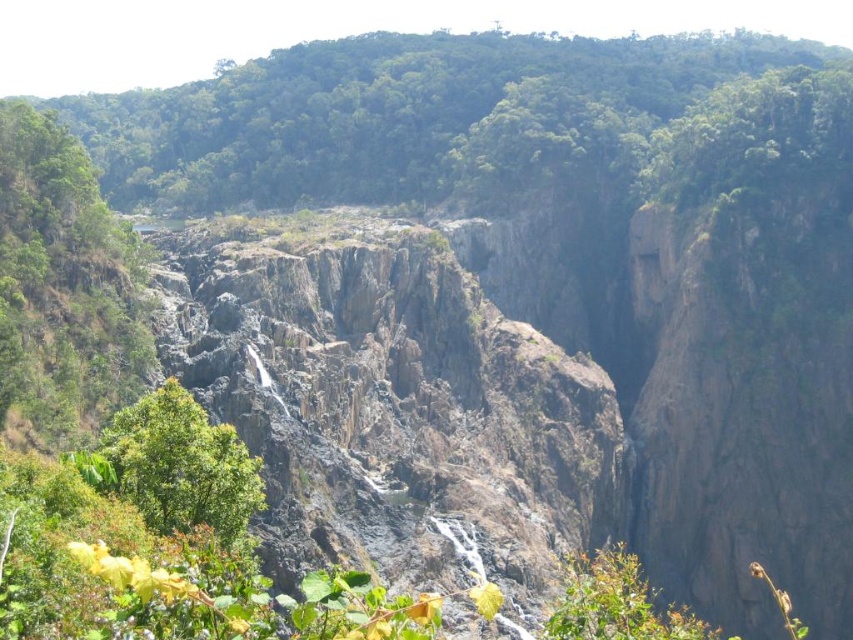
Question: Does green leafy trees at upper center appear on the left side of green leafy tree at lower left?

Choices:
 (A) yes
 (B) no

Answer: (B)

Question: Does green leafy trees at upper center have a greater width compared to green leafy tree at lower left?

Choices:
 (A) no
 (B) yes

Answer: (B)

Question: Which object appears closest to the camera in this image?

Choices:
 (A) green leafy trees at upper center
 (B) green leafy tree at lower left

Answer: (B)

Question: Does green leafy trees at upper center appear on the right side of green leafy tree at lower left?

Choices:
 (A) no
 (B) yes

Answer: (B)

Question: Which point is closer to the camera taking this photo?

Choices:
 (A) (213, 534)
 (B) (415, 84)

Answer: (A)